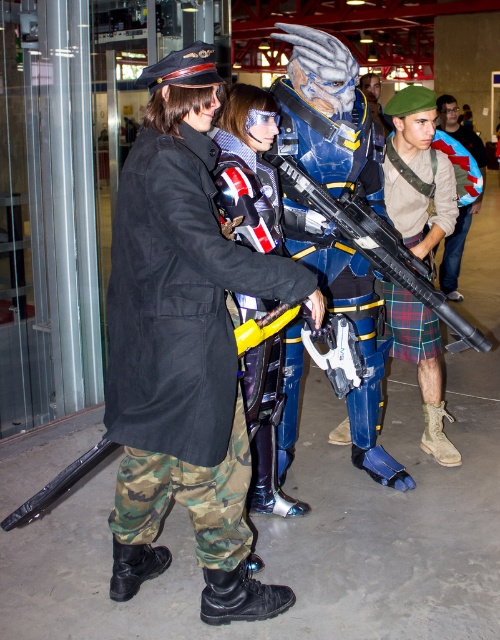
Who is positioned more to the left, camouflage fabric pants at left or camouflage pants at center?

Positioned to the left is camouflage fabric pants at left.

Is camouflage fabric pants at left thinner than camouflage pants at center?

Incorrect, camouflage fabric pants at left's width is not less than camouflage pants at center's.

Which is behind, point (216, 272) or point (481, 150)?

Positioned behind is point (481, 150).

Locate an element on the screen. The image size is (500, 640). camouflage fabric pants at left is located at coordinates (181, 348).

You are a GUI agent. You are given a task and a screenshot of the screen. Output one action in this format:
    pyautogui.click(x=<x>, y=<y>)
    Task: Click on the camouflage fabric pants at left
    Image resolution: width=500 pixels, height=640 pixels.
    Given the screenshot: What is the action you would take?
    pyautogui.click(x=181, y=348)

Which of these two, camouflage fabric pants at left or shiny blue armor at center, stands shorter?

With less height is camouflage fabric pants at left.

Where is `camouflage fabric pants at left`? The height and width of the screenshot is (640, 500). camouflage fabric pants at left is located at coordinates (181, 348).

Find the location of a particular element. Image resolution: width=500 pixels, height=640 pixels. shiny blue armor at center is located at coordinates (328, 116).

Measure the distance between point (290, 404) and camera.

Point (290, 404) and camera are 3.01 meters apart from each other.

The height and width of the screenshot is (640, 500). I want to click on shiny blue armor at center, so click(x=328, y=116).